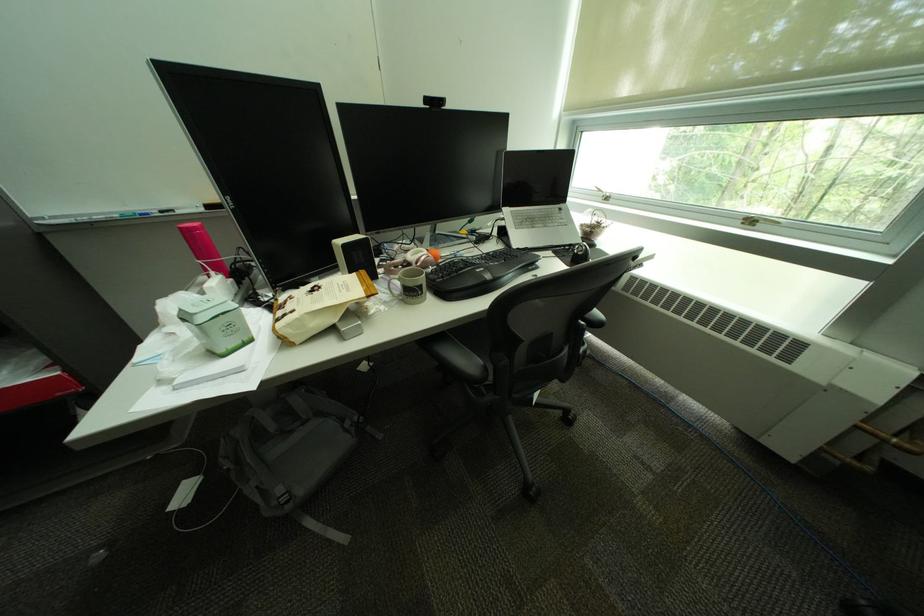
Where would you lift the backpack top handle? Please return your answer as a coordinate pair (x, y).

(290, 453)